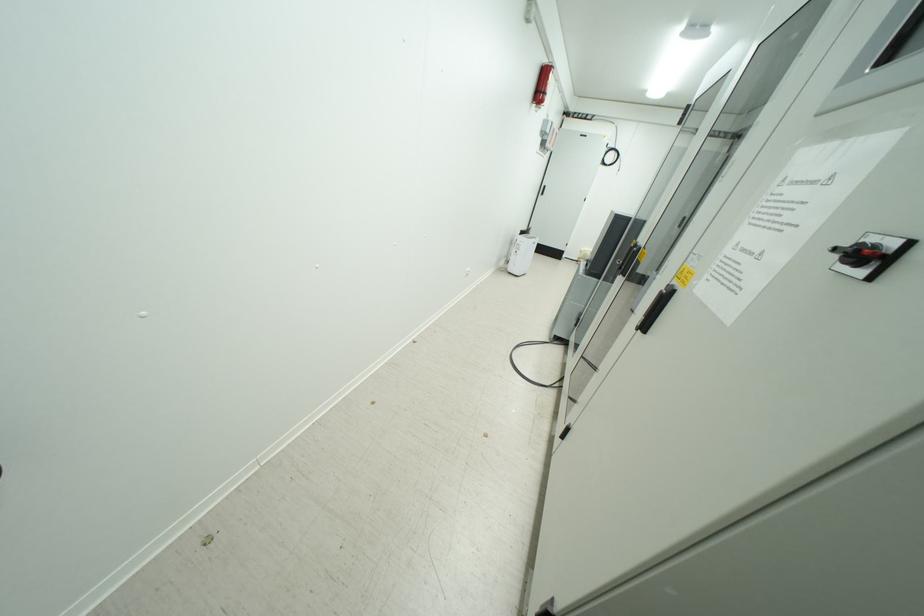
The height and width of the screenshot is (616, 924). What do you see at coordinates (655, 308) in the screenshot?
I see `a black cabinet handle` at bounding box center [655, 308].